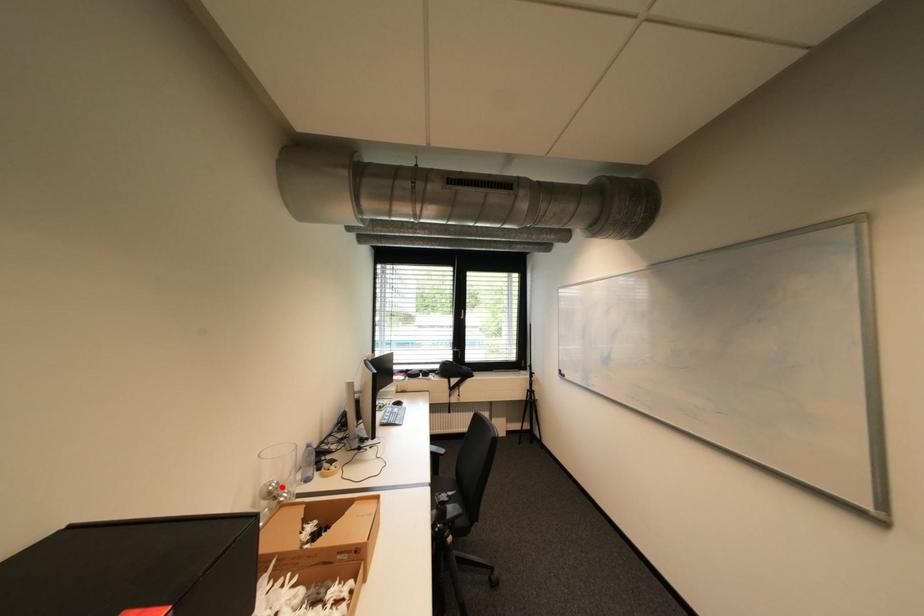
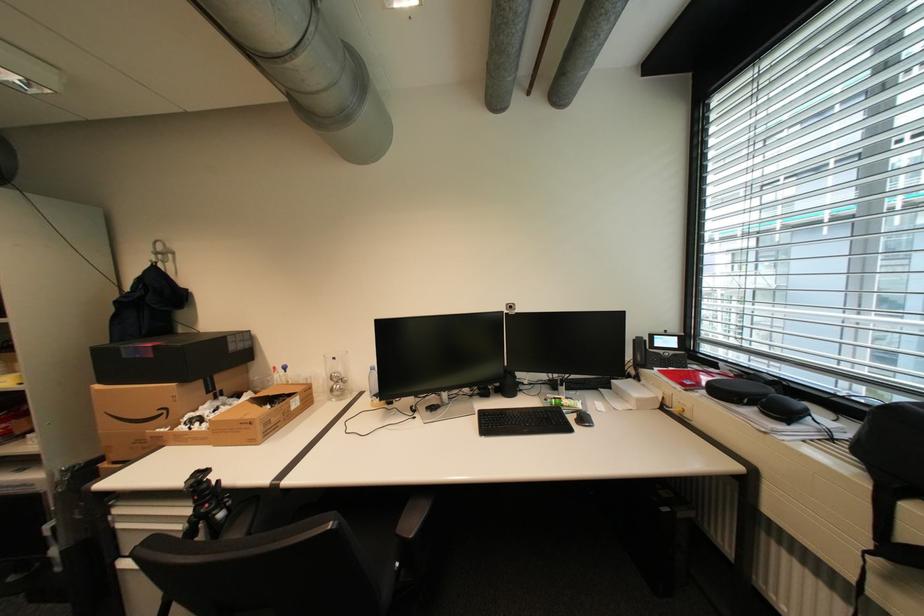
In the second image, find the point that corresponds to the highlighted location in the first image.

(343, 376)